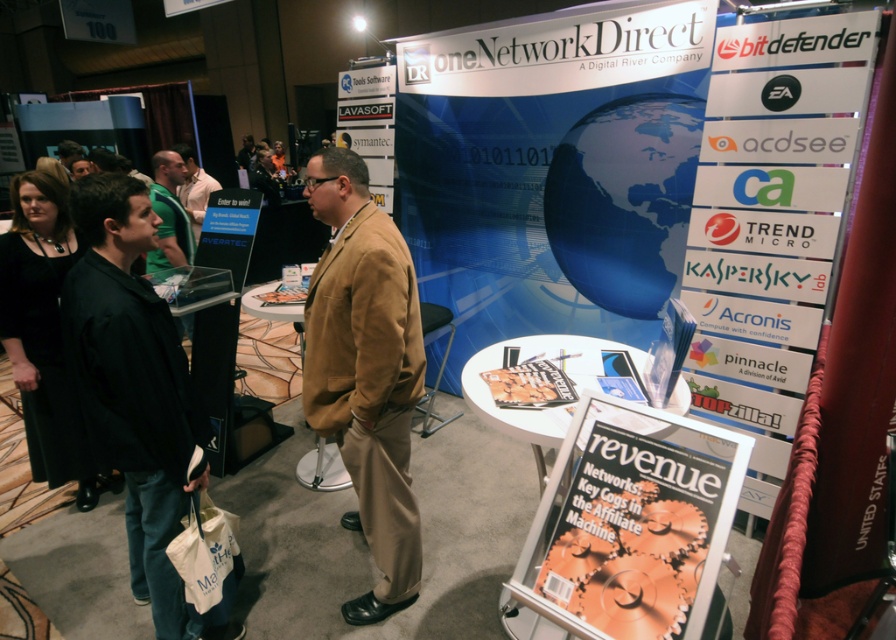
You are at the oneNetworkDirect booth and want to pick up the matte white magazine at center and the white plastic sign at upper center. Which object should you pick up first if you want to start with the smaller one?

The matte white magazine at center is smaller than the white plastic sign at upper center, so you should pick up the matte white magazine at center first.

You are a photographer at the trade show and need to capture both the green fabric shirt at upper left and the white shirt at center in a single shot. Based on their positions, which shirt should you focus on first to ensure both are in frame?

The green fabric shirt at upper left is taller than the white shirt at center. To ensure both are in frame, focus on the green fabric shirt at upper left first as it occupies more vertical space, allowing the white shirt at center to naturally fit within the shot.

You are a photographer at the trade show and need to capture a clear shot of the green fabric shirt at upper left and the white shirt at center. Which shirt should you focus on first to ensure both are in focus without moving the camera?

You should focus on the green fabric shirt at upper left first because it is in front of the white shirt at center, so if you focus on the closer object, the background object will also be in focus due to depth of field.